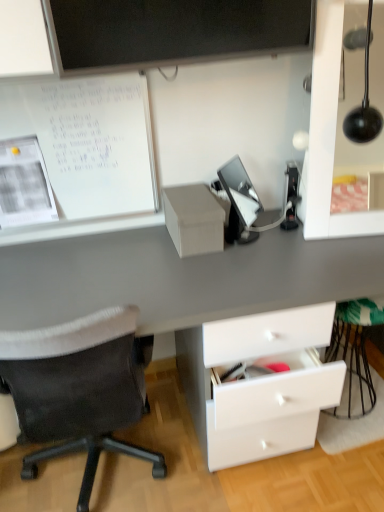
Question: From a real-world perspective, is white matte paperboard at upper left on matte black lamp at upper right?

Choices:
 (A) no
 (B) yes

Answer: (A)

Question: Is white matte paperboard at upper left facing away from matte black lamp at upper right?

Choices:
 (A) yes
 (B) no

Answer: (B)

Question: Considering the relative positions of white matte paperboard at upper left and matte black lamp at upper right in the image provided, is white matte paperboard at upper left to the left of matte black lamp at upper right from the viewer's perspective?

Choices:
 (A) no
 (B) yes

Answer: (B)

Question: Can you confirm if white matte paperboard at upper left is wider than matte black lamp at upper right?

Choices:
 (A) yes
 (B) no

Answer: (B)

Question: Considering the relative sizes of white matte paperboard at upper left and matte black lamp at upper right in the image provided, is white matte paperboard at upper left bigger than matte black lamp at upper right?

Choices:
 (A) yes
 (B) no

Answer: (B)

Question: Considering the relative sizes of white matte paperboard at upper left and matte black lamp at upper right in the image provided, is white matte paperboard at upper left smaller than matte black lamp at upper right?

Choices:
 (A) yes
 (B) no

Answer: (A)

Question: From a real-world perspective, is black fabric chair at left below matte cardboard box at center?

Choices:
 (A) yes
 (B) no

Answer: (A)

Question: Is black fabric chair at left aimed at matte cardboard box at center?

Choices:
 (A) no
 (B) yes

Answer: (A)

Question: Is black fabric chair at left outside of matte cardboard box at center?

Choices:
 (A) yes
 (B) no

Answer: (A)

Question: Considering the relative positions of black fabric chair at left and matte cardboard box at center in the image provided, is black fabric chair at left to the left of matte cardboard box at center from the viewer's perspective?

Choices:
 (A) no
 (B) yes

Answer: (B)

Question: From the image's perspective, is black fabric chair at left located above matte cardboard box at center?

Choices:
 (A) no
 (B) yes

Answer: (A)

Question: Can you confirm if black fabric chair at left is bigger than matte cardboard box at center?

Choices:
 (A) no
 (B) yes

Answer: (B)

Question: Is matte cardboard box at center oriented towards matte black lamp at upper right?

Choices:
 (A) no
 (B) yes

Answer: (A)